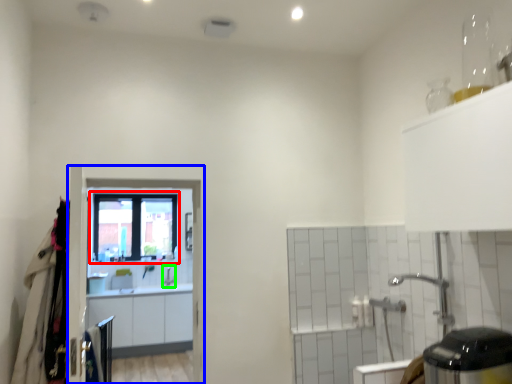
Question: Which object is positioned closest to window (highlighted by a red box)? Select from screen door (highlighted by a blue box) and faucet (highlighted by a green box).

Choices:
 (A) screen door
 (B) faucet

Answer: (B)